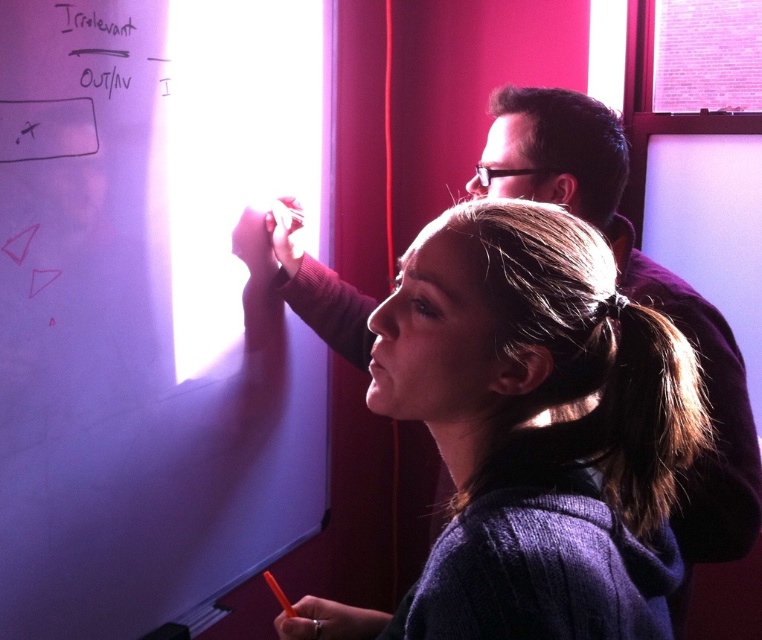
You are an interior designer planning to hang a large painting that requires a 1.2 meter height space. You observe the white matte board at upper left and the white paper at upper left. Which object can accommodate the painting based on their height?

The white matte board at upper left has a greater height compared to the white paper at upper left. Therefore, the white matte board at upper left can accommodate the painting since it meets the required 1.2 meter height space.

You are a person who needs to reach the white paper at upper left from the purple sweater at center. Can you stretch your hand to grab it without moving your feet?

The distance between the purple sweater at center and the white paper at upper left is 34.15 inches. The average human arm length is about 25 to 30 inches. Therefore, it would be difficult to reach the white paper at upper left without moving your feet.